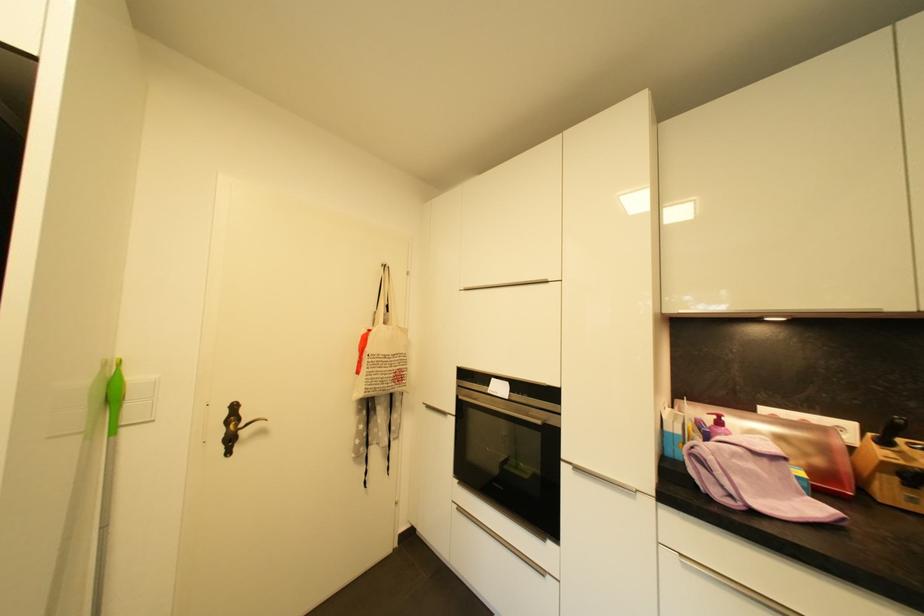
Find the location of a particular element. oven door handle is located at coordinates (502, 410).